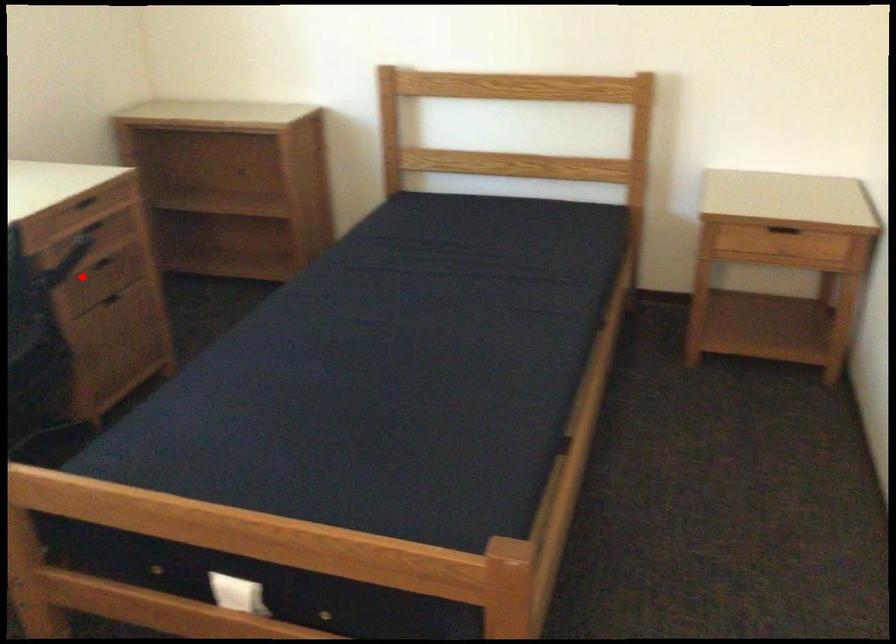
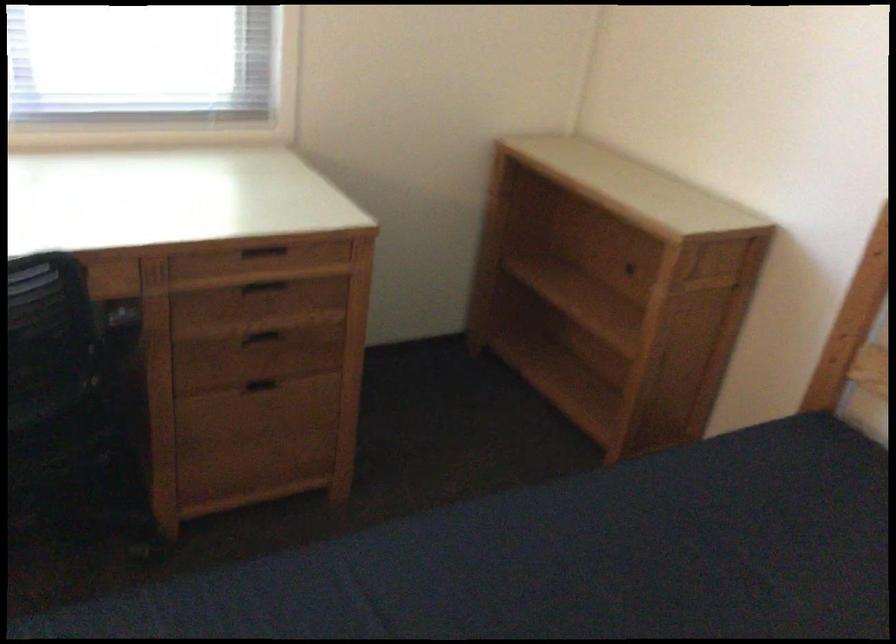
Question: I am providing you with two images of the same scene from different viewpoints. Given a red point in image1, look at the same physical point in image2. Is it:

Choices:
 (A) Closer to the viewpoint
 (B) Farther from the viewpoint

Answer: (A)